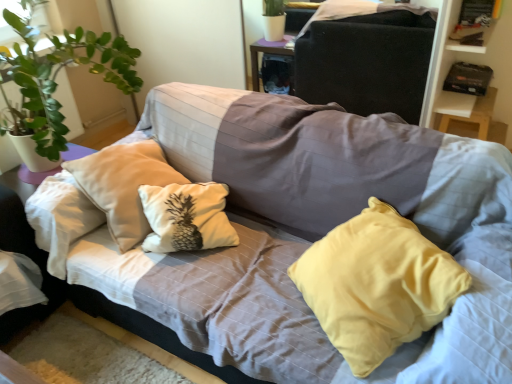
Question: Does matte fabric couch at upper center have a lesser width compared to black cardboard box at upper right?

Choices:
 (A) yes
 (B) no

Answer: (A)

Question: Considering the relative sizes of matte fabric couch at upper center and black cardboard box at upper right in the image provided, is matte fabric couch at upper center wider than black cardboard box at upper right?

Choices:
 (A) no
 (B) yes

Answer: (A)

Question: Can you confirm if matte fabric couch at upper center is positioned to the right of black cardboard box at upper right?

Choices:
 (A) no
 (B) yes

Answer: (A)

Question: Is matte fabric couch at upper center shorter than black cardboard box at upper right?

Choices:
 (A) no
 (B) yes

Answer: (B)

Question: Is matte fabric couch at upper center completely or partially outside of black cardboard box at upper right?

Choices:
 (A) yes
 (B) no

Answer: (A)

Question: Could you tell me if matte fabric couch at upper center is facing black cardboard box at upper right?

Choices:
 (A) yes
 (B) no

Answer: (B)

Question: Is black cardboard box at upper right next to matte fabric couch at upper center and touching it?

Choices:
 (A) no
 (B) yes

Answer: (A)

Question: Considering the relative sizes of black cardboard box at upper right and matte fabric couch at upper center in the image provided, is black cardboard box at upper right taller than matte fabric couch at upper center?

Choices:
 (A) yes
 (B) no

Answer: (A)

Question: Does black cardboard box at upper right appear on the left side of matte fabric couch at upper center?

Choices:
 (A) no
 (B) yes

Answer: (A)

Question: Is black cardboard box at upper right shorter than matte fabric couch at upper center?

Choices:
 (A) yes
 (B) no

Answer: (B)

Question: Is black cardboard box at upper right at the right side of matte fabric couch at upper center?

Choices:
 (A) no
 (B) yes

Answer: (B)

Question: Considering the relative positions of black cardboard box at upper right and matte fabric couch at upper center in the image provided, is black cardboard box at upper right in front of matte fabric couch at upper center?

Choices:
 (A) yes
 (B) no

Answer: (A)

Question: From the image's perspective, is yellow fabric pillow at center located beneath matte fabric couch at upper center?

Choices:
 (A) no
 (B) yes

Answer: (B)